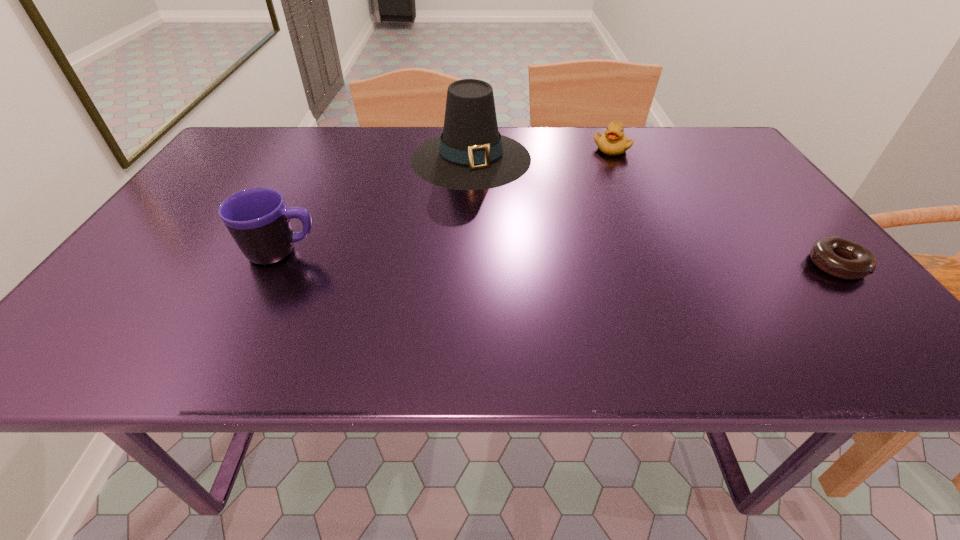
Find the location of a particular element. free space on the desktop that is between the leftmost object and the doughnut and is positioned on the front-facing side of the hat is located at coordinates (499, 257).

Locate an element on the screen. Image resolution: width=960 pixels, height=540 pixels. vacant space on the desktop that is between the mug and the shortest object and is positioned at the beak of the second object from right to left is located at coordinates (530, 258).